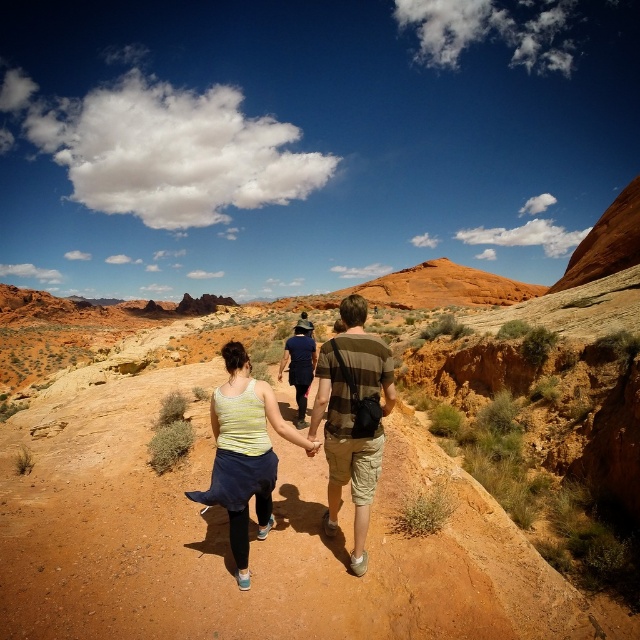
You are a photographer trying to capture a clear shot of the camouflage shorts at center and the striped cotton shirt at center. Which one should you zoom in on to ensure it fills the frame better?

The camouflage shorts at center is larger in size than the striped cotton shirt at center, so you should zoom in on the camouflage shorts at center to ensure it fills the frame better.